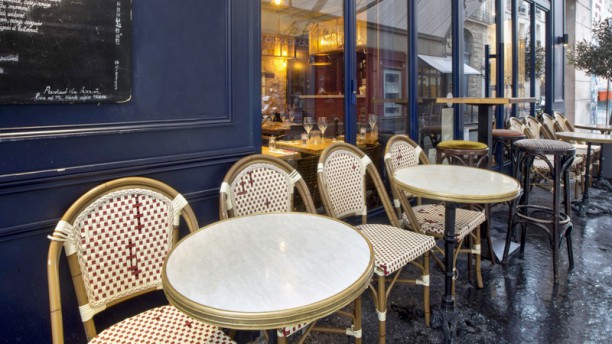
Find the location of `glasses inside of restuarant`. glasses inside of restuarant is located at coordinates (264, 117), (271, 116), (282, 117), (291, 114), (307, 126), (321, 124), (271, 145), (302, 138), (360, 133), (373, 122).